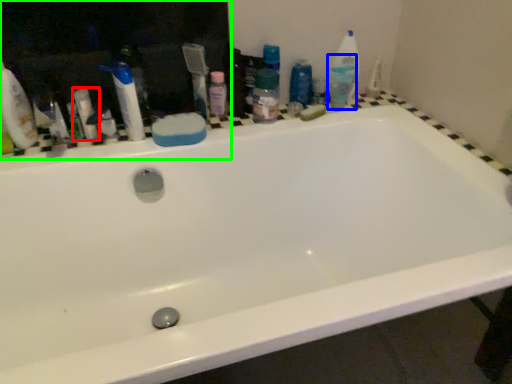
Question: Considering the real-world distances, which object is farthest from toiletry (highlighted by a red box)? toiletry (highlighted by a blue box) or medicine cabinet (highlighted by a green box)?

Choices:
 (A) toiletry
 (B) medicine cabinet

Answer: (A)